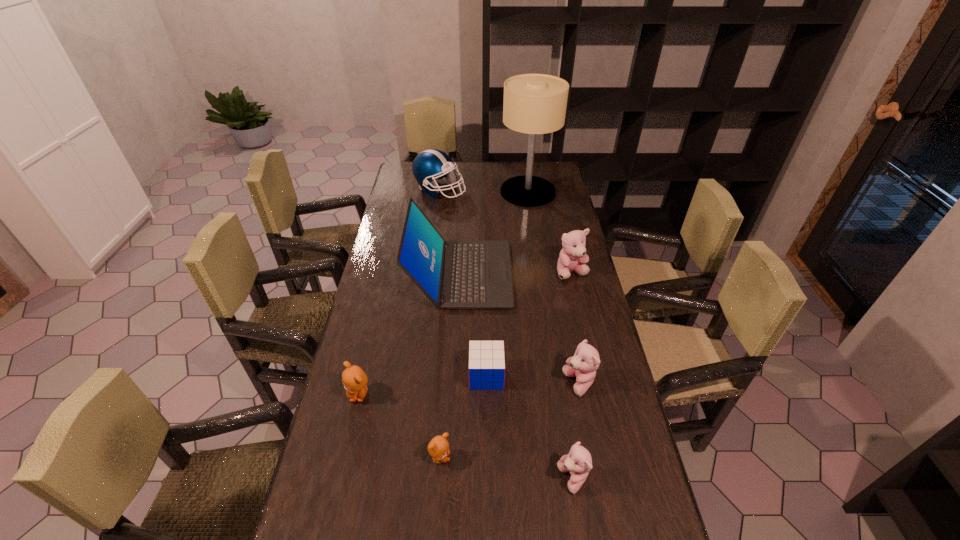
Find the location of a particular element. The image size is (960, 540). vacant point located between the football helmet and the beige table lamp is located at coordinates (484, 191).

Image resolution: width=960 pixels, height=540 pixels. Identify the location of vacant area that lies between the nearest pink teddy bear and the bigger brown teddy bear. (466, 436).

Where is `unoccupied area between the smaller brown teddy bear and the blue football helmet`? The height and width of the screenshot is (540, 960). unoccupied area between the smaller brown teddy bear and the blue football helmet is located at coordinates click(440, 324).

Locate an element on the screen. The width and height of the screenshot is (960, 540). vacant area that lies between the beige table lamp and the smallest pink teddy bear is located at coordinates (550, 335).

Where is `unoccupied area between the second tallest teddy bear and the tallest object`? The width and height of the screenshot is (960, 540). unoccupied area between the second tallest teddy bear and the tallest object is located at coordinates pos(554,288).

Locate an element on the screen. The width and height of the screenshot is (960, 540). vacant area that lies between the blue football helmet and the biggest pink teddy bear is located at coordinates (506, 232).

You are a GUI agent. You are given a task and a screenshot of the screen. Output one action in this format:
    pyautogui.click(x=<x>, y=<y>)
    Task: Click on the free area in between the shortest teddy bear and the beige table lamp
    This screenshot has width=960, height=540.
    Given the screenshot: What is the action you would take?
    pyautogui.click(x=484, y=325)

I want to click on object that stands as the eighth closest to the gray laptop computer, so click(x=578, y=462).

I want to click on object that stands as the closest to the gray laptop computer, so [572, 258].

What are the coordinates of `teddy bear that can be found as the closest to the smallest pink teddy bear` in the screenshot? It's located at (583, 365).